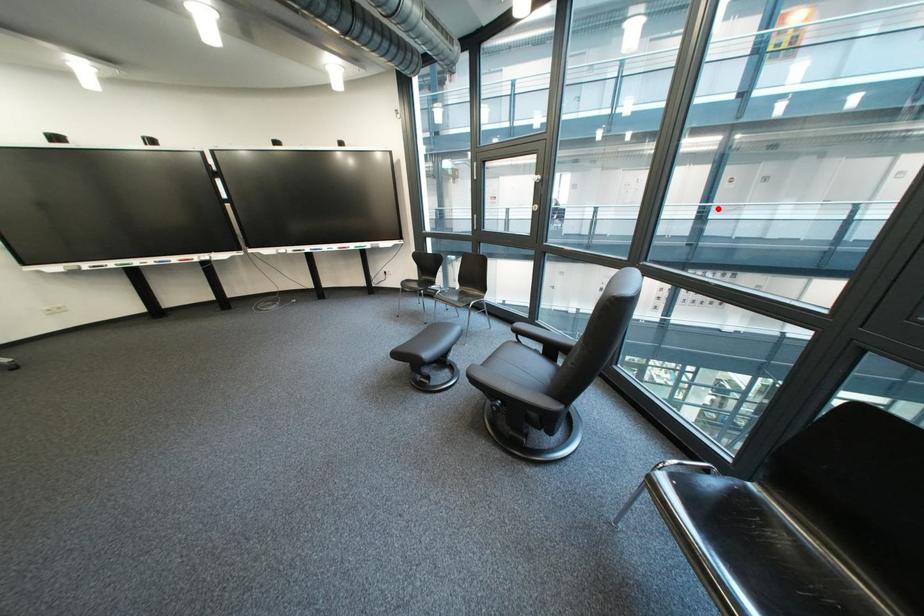
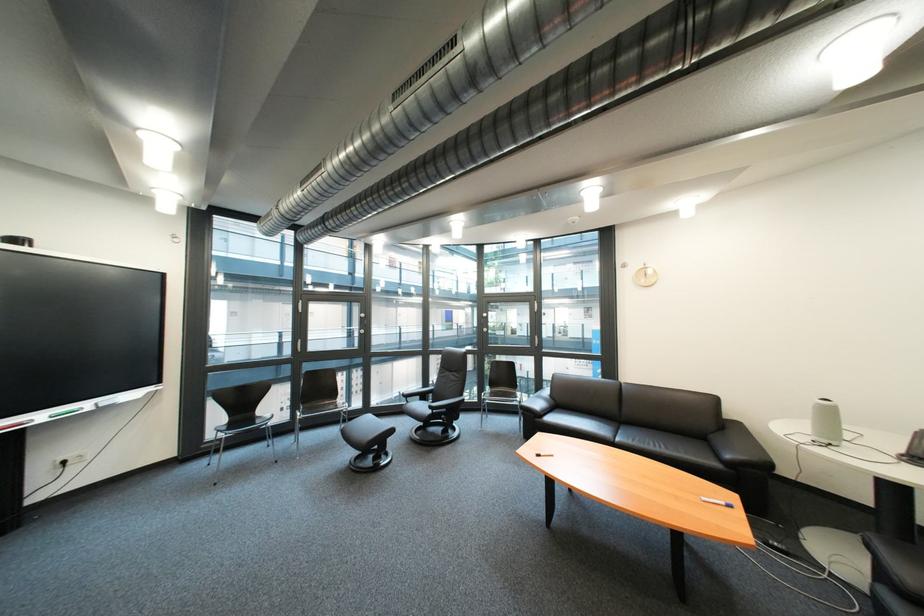
Find the pixel in the second image that matches the highlighted location in the first image.

(363, 331)